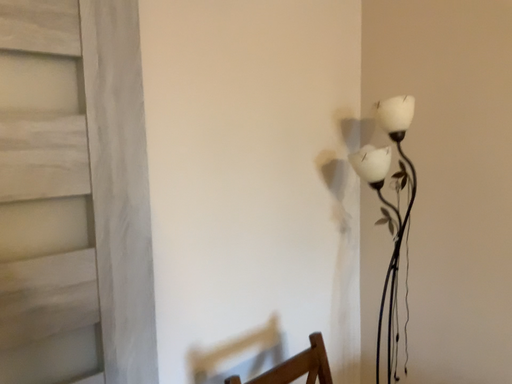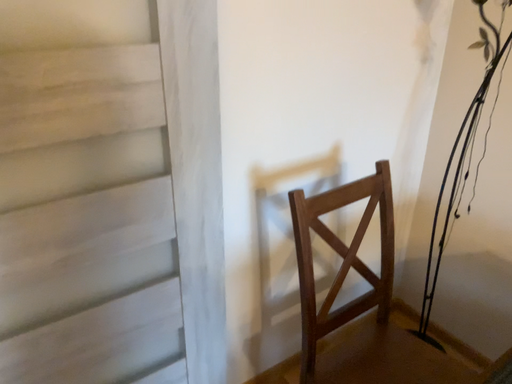
Question: How did the camera likely rotate when shooting the video?

Choices:
 (A) rotated left
 (B) rotated right

Answer: (A)